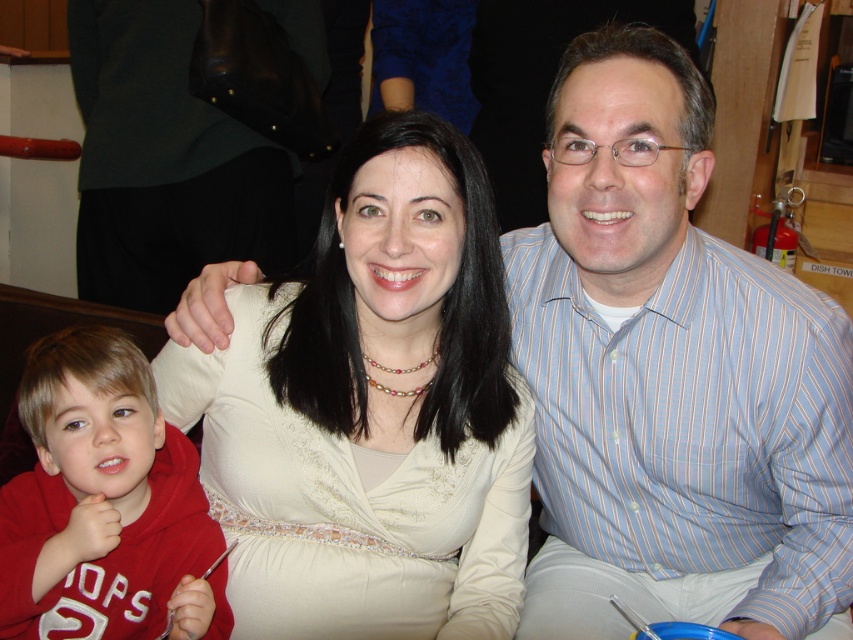
Question: Which point is closer to the camera taking this photo?

Choices:
 (A) (x=165, y=508)
 (B) (x=285, y=593)

Answer: (A)

Question: Which point is farther to the camera?

Choices:
 (A) (106, 428)
 (B) (509, 620)

Answer: (B)

Question: Does matte white blouse at center have a smaller size compared to red fleece hoodie at lower left?

Choices:
 (A) yes
 (B) no

Answer: (B)

Question: Does matte white blouse at center appear over red fleece hoodie at lower left?

Choices:
 (A) yes
 (B) no

Answer: (A)

Question: Is matte white blouse at center wider than red fleece hoodie at lower left?

Choices:
 (A) yes
 (B) no

Answer: (A)